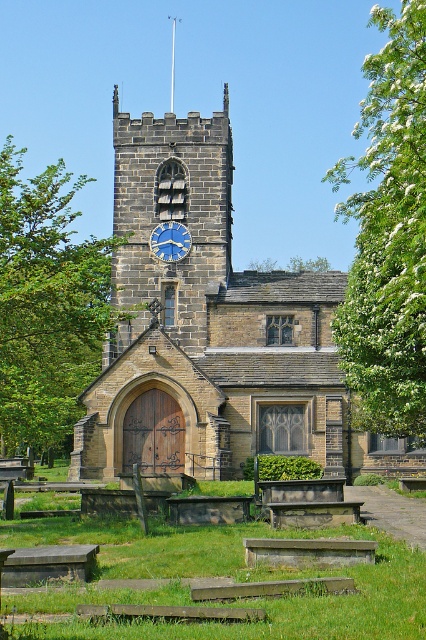
Is point (299, 296) closer to camera compared to point (13, 157)?

Yes, point (299, 296) is in front of point (13, 157).

Who is more distant from viewer, (164, 323) or (29, 253)?

Positioned behind is point (164, 323).

The height and width of the screenshot is (640, 426). I want to click on brown stone church at center, so (204, 326).

Is white blossoming tree at upper right taller than blue painted stone clock at upper center?

Indeed, white blossoming tree at upper right has a greater height compared to blue painted stone clock at upper center.

Between point (371, 374) and point (155, 237), which one is positioned behind?

The point (155, 237) is behind.

Measure the distance between point (379, 337) and camera.

Point (379, 337) is 81.33 meters away from camera.

Locate an element on the screen. white blossoming tree at upper right is located at coordinates (388, 234).

In the scene shown: Does brown stone church at center have a lesser width compared to white blossoming tree at upper right?

Incorrect, brown stone church at center's width is not less than white blossoming tree at upper right's.

Which is more to the right, brown stone church at center or white blossoming tree at upper right?

white blossoming tree at upper right is more to the right.

Is point (207, 396) farther from viewer compared to point (388, 132)?

That is True.

At what (x,y) coordinates should I click in order to perform the action: click on brown stone church at center. Please return your answer as a coordinate pair (x, y). The height and width of the screenshot is (640, 426). Looking at the image, I should click on (204, 326).